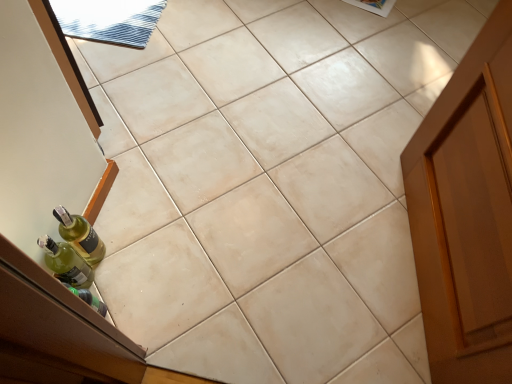
Find the location of a particular element. The height and width of the screenshot is (384, 512). empty space that is to the right of green glass bottle at lower left, which is counted as the second bottle, starting from the bottom is located at coordinates (151, 264).